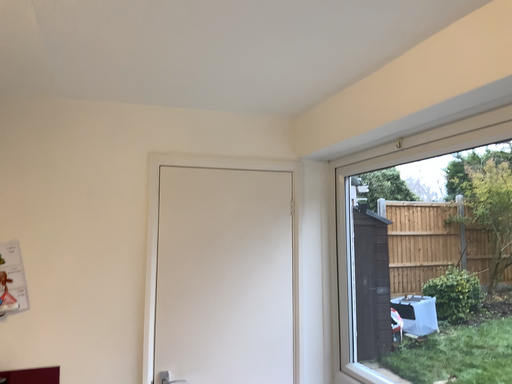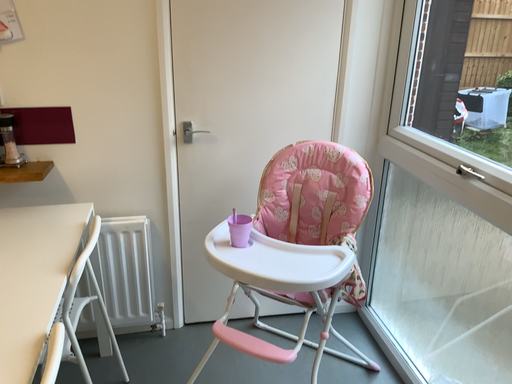
Question: Which way did the camera rotate in the video?

Choices:
 (A) rotated upward
 (B) rotated downward

Answer: (B)